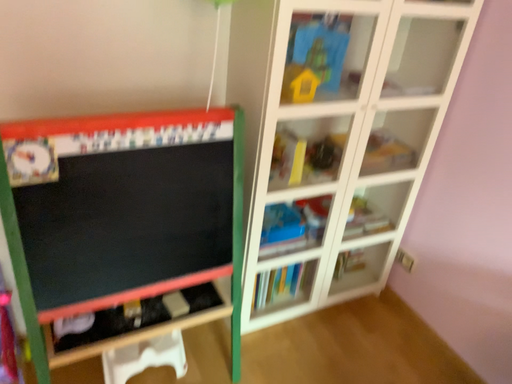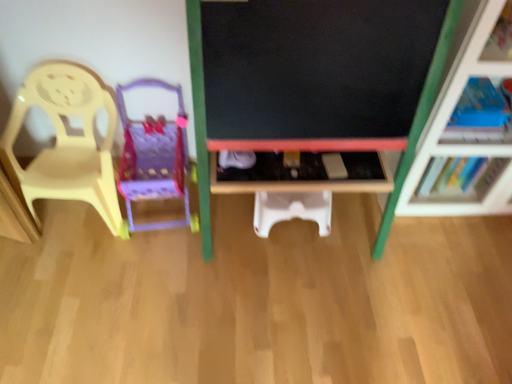
Question: How did the camera likely rotate when shooting the video?

Choices:
 (A) rotated upward
 (B) rotated downward

Answer: (B)